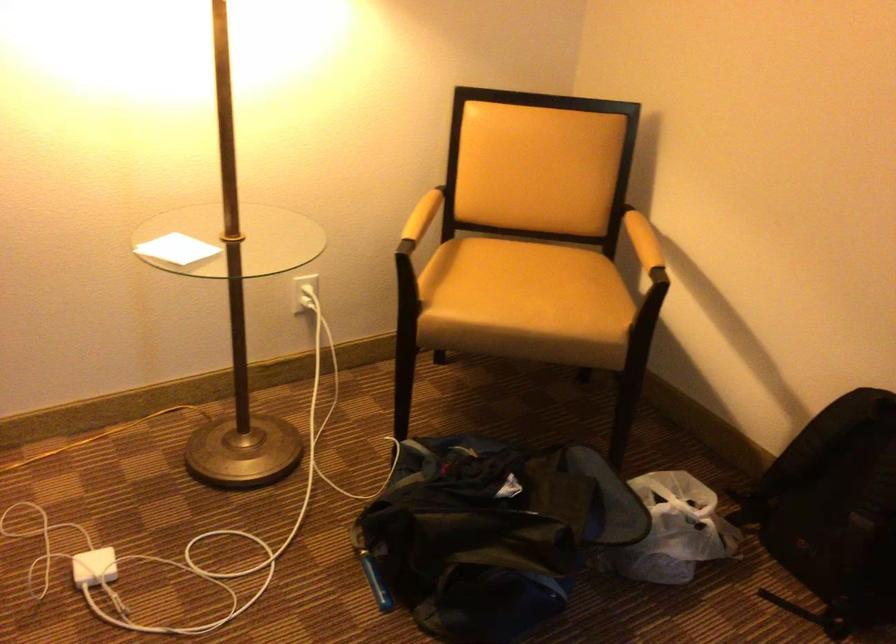
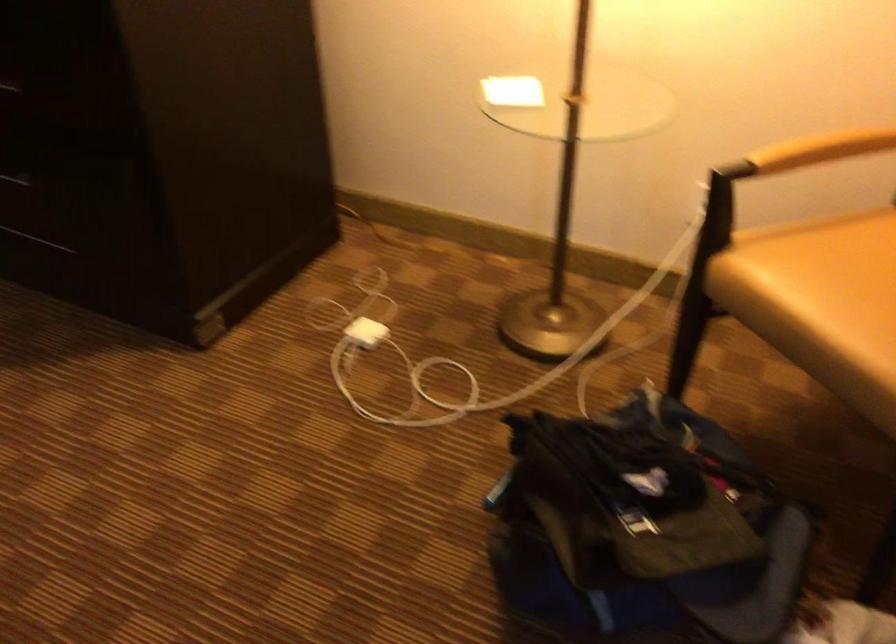
Locate, in the second image, the point that corresponds to the point at 98,562 in the first image.

(366, 332)